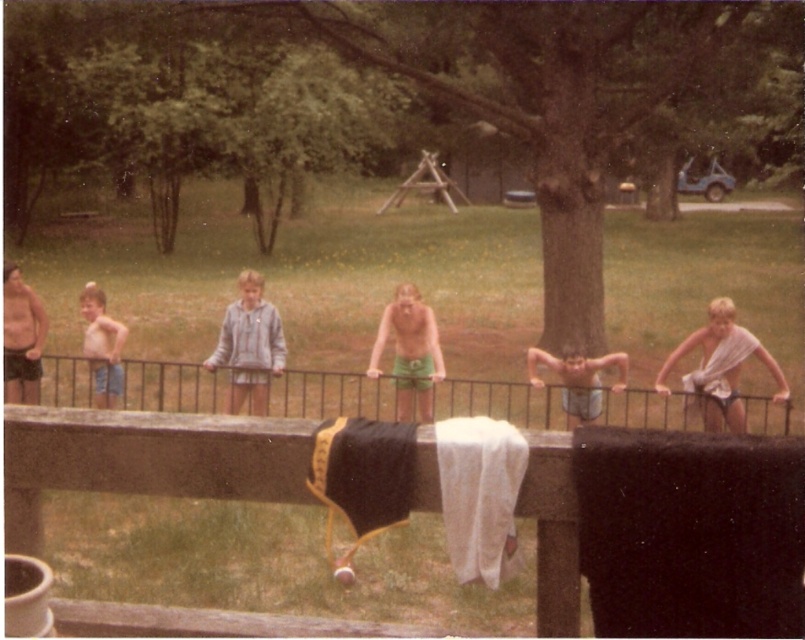
Question: Is green leafy tree at center wider than matte black shorts at left?

Choices:
 (A) no
 (B) yes

Answer: (B)

Question: Which point is closer to the camera?

Choices:
 (A) matte gray shorts at center
 (B) green cotton shorts at center

Answer: (B)

Question: Which of the following is the farthest from the observer?

Choices:
 (A) matte black shorts at left
 (B) light blue denim shorts at left
 (C) light gray hoodie at center

Answer: (A)

Question: Can you confirm if green leafy tree at center is bigger than green cotton shorts at center?

Choices:
 (A) no
 (B) yes

Answer: (B)

Question: Is green cotton shorts at center wider than light blue denim shorts at left?

Choices:
 (A) yes
 (B) no

Answer: (A)

Question: Among these objects, which one is farthest from the camera?

Choices:
 (A) light blue denim shorts at left
 (B) green leafy tree at center
 (C) matte black shorts at left

Answer: (B)